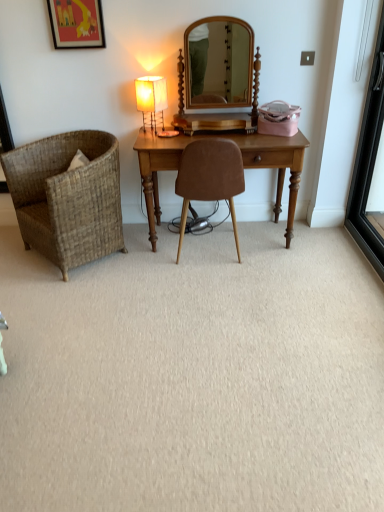
I want to click on free spot in front of brown suede chair at center, which is counted as the 2th chair, starting from the left, so click(x=220, y=285).